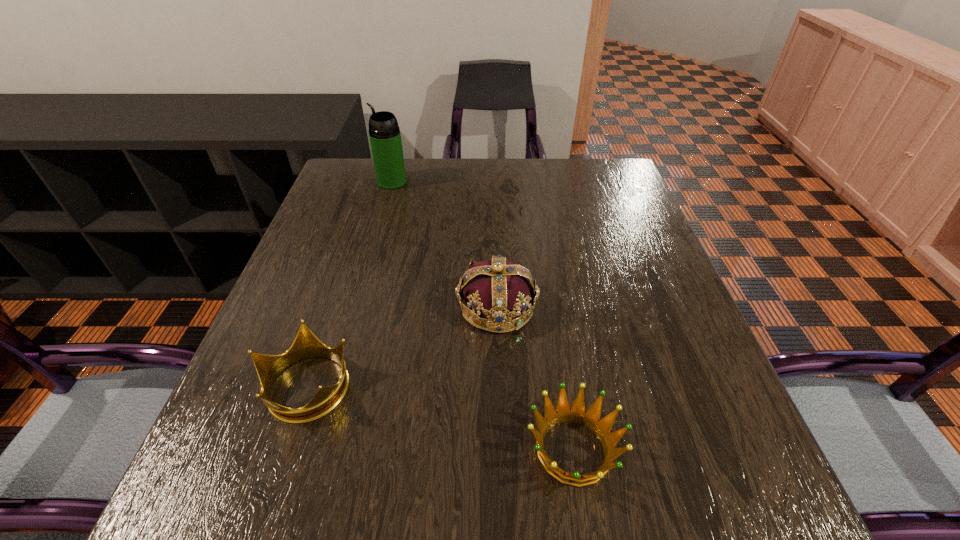
You are a GUI agent. You are given a task and a screenshot of the screen. Output one action in this format:
    pyautogui.click(x=<x>, y=<y>)
    Task: Click on the vacant space that satisfies the following two spatial constraints: 1. from the spout of the farthest crown; 2. on the left side of the farthest object
    This screenshot has width=960, height=540.
    Given the screenshot: What is the action you would take?
    pyautogui.click(x=357, y=307)

Identify the location of vacant space that satisfies the following two spatial constraints: 1. on the back side of the farthest crown; 2. from the spout of the tallest object. (492, 182).

At what (x,y) coordinates should I click in order to perform the action: click on free region that satisfies the following two spatial constraints: 1. on the back side of the third nearest object; 2. from the spout of the thermos bottle. Please return your answer as a coordinate pair (x, y). Looking at the image, I should click on (492, 182).